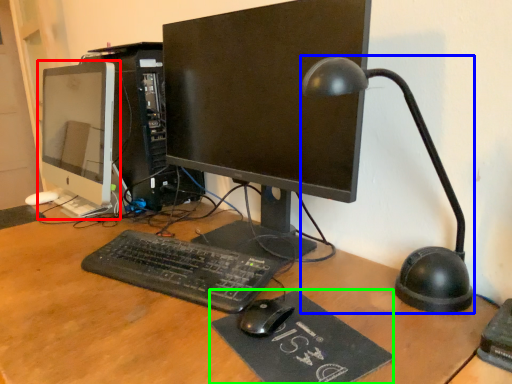
Question: Considering the real-world distances, which object is farthest from computer monitor (highlighted by a red box)? table lamp (highlighted by a blue box) or mousepad (highlighted by a green box)?

Choices:
 (A) table lamp
 (B) mousepad

Answer: (B)